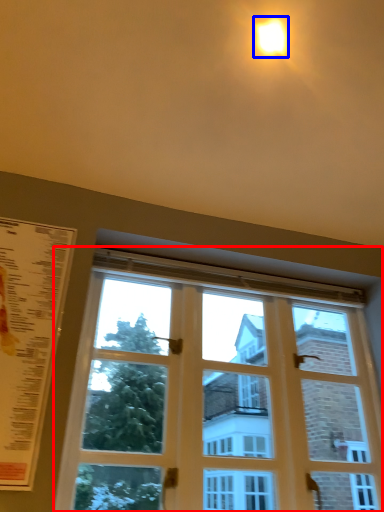
Question: Which of the following is the closest to the observer, window (highlighted by a red box) or light (highlighted by a blue box)?

Choices:
 (A) window
 (B) light

Answer: (A)